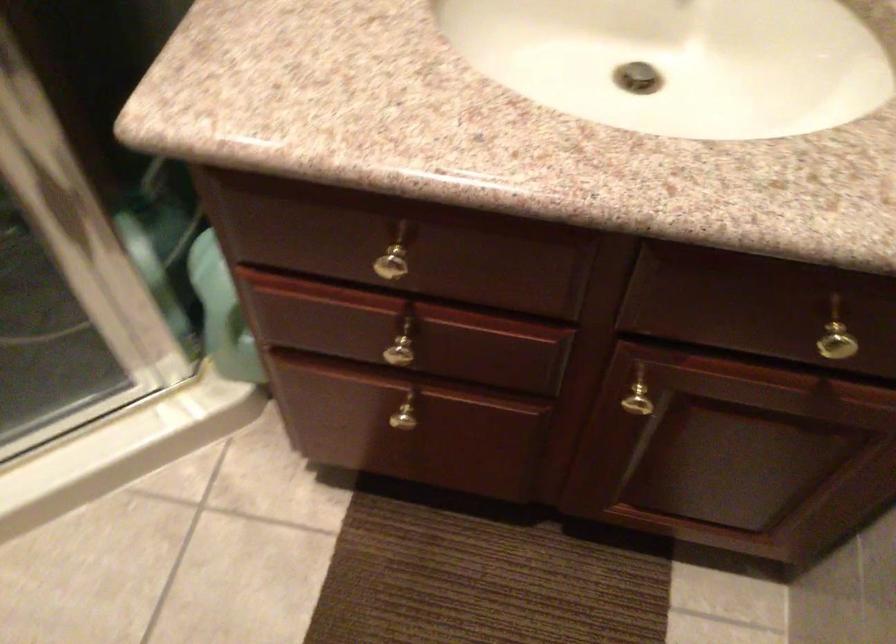
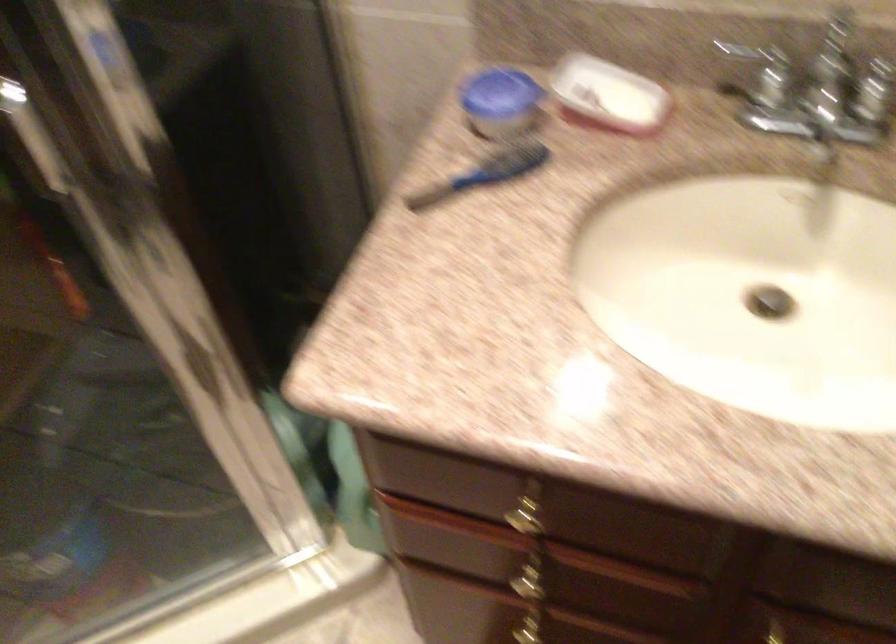
Question: In a continuous first-person perspective shot, in which direction is the camera moving?

Choices:
 (A) Left
 (B) Right
 (C) Forward
 (D) Backward

Answer: (D)